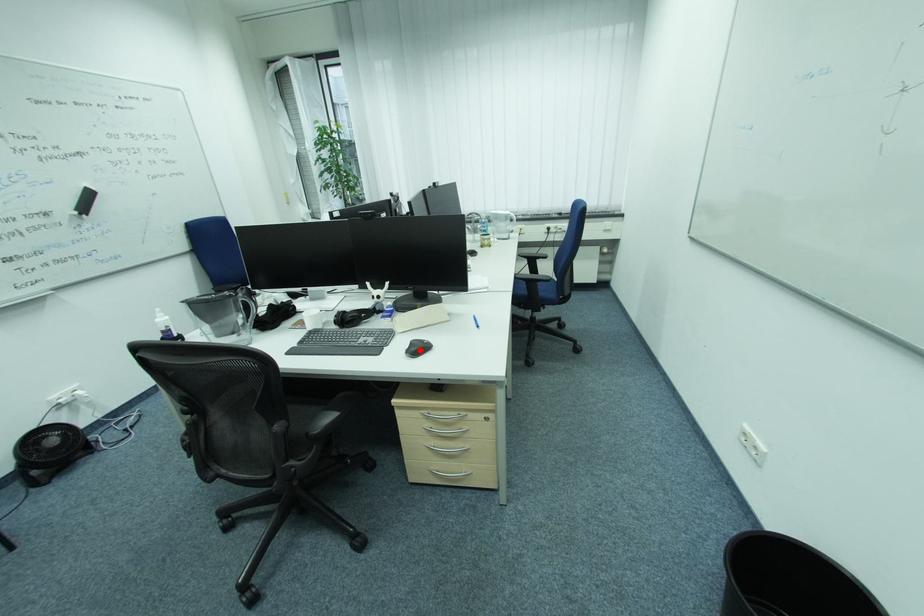
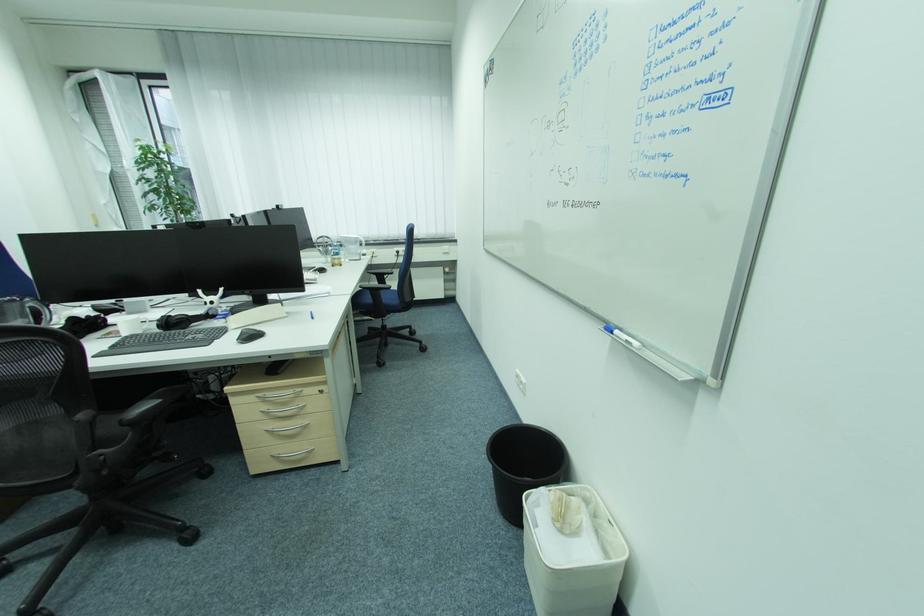
In the second image, find the point that corresponds to the highlighted location in the first image.

(251, 338)